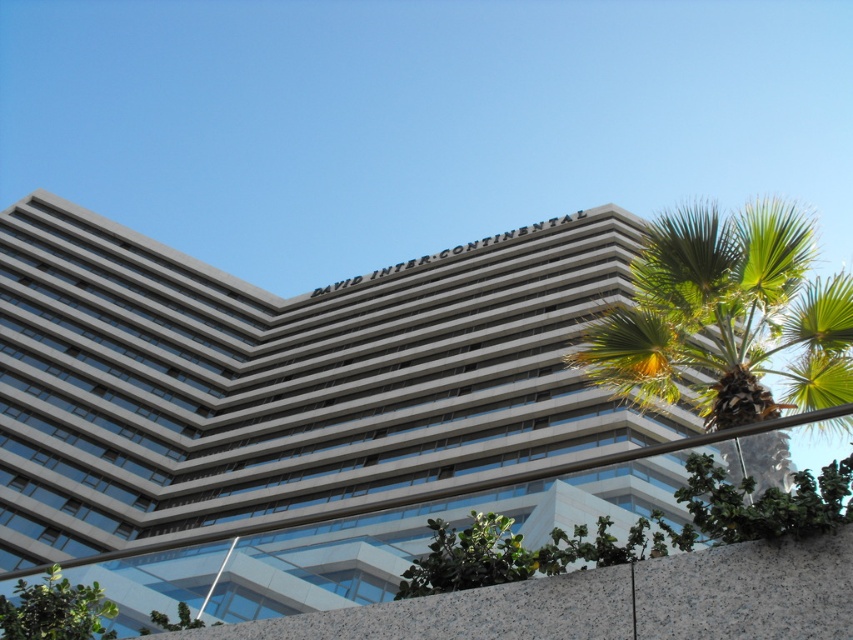
You are standing at the point marked by the coordinates point (456, 538), and you want to take a photo of the David Intercontinental hotel. Considering your current position, will the hotel be in the center of your camera frame?

The point (456, 538) is 15.59 feet away from the viewer. Since the David Intercontinental hotel is the main structure in the scene, it would likely be centered in the camera frame when positioned at this distance, assuming standard camera angles and framing techniques.

You are a landscape architect planning to install a new pathway between the green leafy palm tree at right and the green leafy plant at lower center. The pathway requires a minimum of 20 feet of space. Can the existing space accommodate this requirement?

The distance between the green leafy palm tree at right and the green leafy plant at lower center is 23.16 feet, which exceeds the required 20 feet. Therefore, the existing space can accommodate the pathway.

You are standing in front of the David Intercontinental hotel and want to take a photo of both the green leafy palm tree at right and the green leafy plant at lower center. Which one should you zoom in on first to ensure they both fit in the frame?

The green leafy palm tree at right is bigger than the green leafy plant at lower center, so you should zoom out first to include the larger palm tree, then adjust to ensure the smaller plant is also visible.